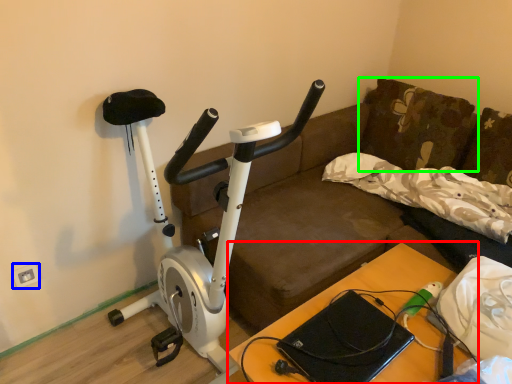
Question: Which object is the farthest from table (highlighted by a red box)? Choose among these: electric outlet (highlighted by a blue box) or pillow (highlighted by a green box).

Choices:
 (A) electric outlet
 (B) pillow

Answer: (A)